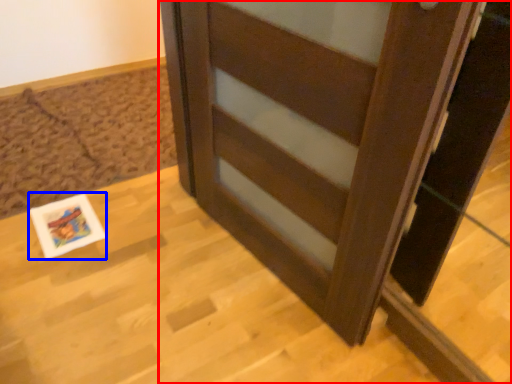
Question: Which object is closer to the camera taking this photo, furniture (highlighted by a red box) or postcard (highlighted by a blue box)?

Choices:
 (A) furniture
 (B) postcard

Answer: (A)